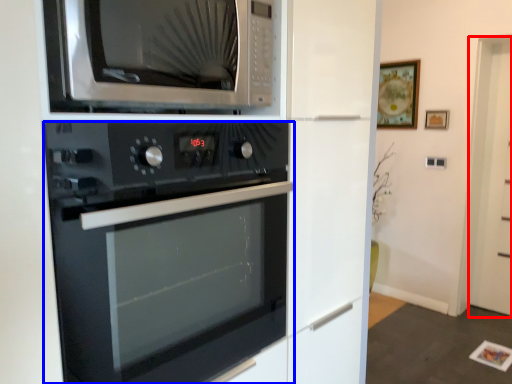
Question: Which object appears closest to the camera in this image, glass door (highlighted by a red box) or oven (highlighted by a blue box)?

Choices:
 (A) glass door
 (B) oven

Answer: (B)